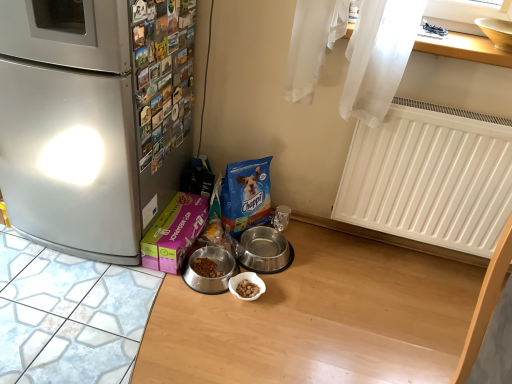
In order to face white plastic radiator at right, should I rotate leftwards or rightwards?

To face it directly, rotate right by 23.452 degrees.

Find the location of `wooden at upper right`. wooden at upper right is located at coordinates (465, 49).

The width and height of the screenshot is (512, 384). Identify the location of metallic stainless steel bowl at center, arranged as the third appliance when viewed from the right. (216, 269).

The image size is (512, 384). I want to click on white plastic radiator at right, so click(x=430, y=177).

Is silver metallic bowl at lower center, which is counted as the second appliance, starting from the bottom, far from pink matte box at lower left?

That's not correct — silver metallic bowl at lower center, which is counted as the second appliance, starting from the bottom, is a little close to pink matte box at lower left.

Is silver metallic bowl at lower center, which is counted as the second appliance, starting from the bottom, further to the viewer compared to pink matte box at lower left?

Yes, the depth of silver metallic bowl at lower center, which is counted as the second appliance, starting from the bottom, is greater than that of pink matte box at lower left.

Is silver metallic bowl at lower center, which is the second appliance in right-to-left order, looking in the opposite direction of pink matte box at lower left?

Absolutely, silver metallic bowl at lower center, which is the second appliance in right-to-left order, is directed away from pink matte box at lower left.

In the scene shown: Is pink matte box at lower left positioned with its back to brushed metal refrigerator at left?

Correct, pink matte box at lower left is looking away from brushed metal refrigerator at left.

From a real-world perspective, is pink matte box at lower left on brushed metal refrigerator at left?

Incorrect, from a real-world perspective, pink matte box at lower left is lower than brushed metal refrigerator at left.

Considering the relative sizes of pink matte box at lower left and brushed metal refrigerator at left in the image provided, is pink matte box at lower left bigger than brushed metal refrigerator at left?

No.

Between pink matte box at lower left and brushed metal refrigerator at left, which one has less height?

pink matte box at lower left.

From the image's perspective, is yellow ceramic bowl at upper right, the first appliance in the top-to-bottom sequence, below metallic stainless steel bowl at center, which appears as the first appliance when ordered from the bottom?

Answer: No.

Does yellow ceramic bowl at upper right, which ranks as the 1th appliance in right-to-left order, have a lesser height compared to metallic stainless steel bowl at center, which is the 1th appliance in left-to-right order?

In fact, yellow ceramic bowl at upper right, which ranks as the 1th appliance in right-to-left order, may be taller than metallic stainless steel bowl at center, which is the 1th appliance in left-to-right order.

Is yellow ceramic bowl at upper right, acting as the 3th appliance starting from the bottom, not within metallic stainless steel bowl at center, which appears as the 3th appliance when viewed from the top?

Yes, yellow ceramic bowl at upper right, acting as the 3th appliance starting from the bottom, is located beyond the bounds of metallic stainless steel bowl at center, which appears as the 3th appliance when viewed from the top.

Which is closer, (x=490, y=20) or (x=187, y=283)?

The point (x=490, y=20) is closer to the camera.

Between white plastic radiator at right and metallic stainless steel bowl at center, which appears as the first appliance when ordered from the bottom, which one appears on the left side from the viewer's perspective?

From the viewer's perspective, metallic stainless steel bowl at center, which appears as the first appliance when ordered from the bottom, appears more on the left side.

Between white plastic radiator at right and metallic stainless steel bowl at center, which appears as the first appliance when ordered from the bottom, which one has larger size?

white plastic radiator at right is bigger.

Is white plastic radiator at right not close to metallic stainless steel bowl at center, which is the 1th appliance in left-to-right order?

No, white plastic radiator at right is in close proximity to metallic stainless steel bowl at center, which is the 1th appliance in left-to-right order.

Can you confirm if white plastic radiator at right is shorter than metallic stainless steel bowl at center, which appears as the first appliance when ordered from the bottom?

No, white plastic radiator at right is not shorter than metallic stainless steel bowl at center, which appears as the first appliance when ordered from the bottom.

Can you tell me how much metallic stainless steel bowl at center, which appears as the first appliance when ordered from the bottom, and brushed metal refrigerator at left differ in facing direction?

7.9 degrees.

Does metallic stainless steel bowl at center, arranged as the third appliance when viewed from the right, have a lesser width compared to brushed metal refrigerator at left?

Indeed, metallic stainless steel bowl at center, arranged as the third appliance when viewed from the right, has a lesser width compared to brushed metal refrigerator at left.

Identify the location of refrigerator that appears in front of the metallic stainless steel bowl at center, which is the 1th appliance in left-to-right order. This screenshot has height=384, width=512. (94, 119).

Is point (219, 266) more distant than point (14, 110)?

Yes, point (219, 266) is farther from viewer.

Do you think wooden at upper right is within silver metallic bowl at lower center, which is counted as the second appliance, starting from the bottom, or outside of it?

The correct answer is: outside.

From the picture: Considering the positions of objects wooden at upper right and silver metallic bowl at lower center, which is counted as the second appliance, starting from the bottom, in the image provided, who is more to the left, wooden at upper right or silver metallic bowl at lower center, which is counted as the second appliance, starting from the bottom,?

From the viewer's perspective, silver metallic bowl at lower center, which is counted as the second appliance, starting from the bottom, appears more on the left side.

Who is taller, wooden at upper right or silver metallic bowl at lower center, which is the second appliance in right-to-left order?

With more height is silver metallic bowl at lower center, which is the second appliance in right-to-left order.

The image size is (512, 384). In order to click on appliance that is the 1st object directly below the wooden at upper right (from a real-world perspective) in this screenshot , I will do `click(264, 250)`.

Which object is closer to the camera, metallic stainless steel bowl at center, which is the 1th appliance in left-to-right order, or wooden at upper right?

Positioned in front is wooden at upper right.

Which of these two, metallic stainless steel bowl at center, arranged as the third appliance when viewed from the right, or wooden at upper right, is bigger?

Bigger between the two is metallic stainless steel bowl at center, arranged as the third appliance when viewed from the right.

Between metallic stainless steel bowl at center, arranged as the third appliance when viewed from the right, and wooden at upper right, which one appears on the left side from the viewer's perspective?

From the viewer's perspective, metallic stainless steel bowl at center, arranged as the third appliance when viewed from the right, appears more on the left side.

From a real-world perspective, is metallic stainless steel bowl at center, which appears as the first appliance when ordered from the bottom, physically located above or below wooden at upper right?

In terms of real-world spatial position, metallic stainless steel bowl at center, which appears as the first appliance when ordered from the bottom, is below wooden at upper right.

This screenshot has height=384, width=512. In order to click on box positioned vertically above the silver metallic bowl at lower center, which is counted as the second appliance, starting from the bottom (from a real-world perspective) in this screenshot , I will do `click(174, 233)`.

Find the location of a particular element. The image size is (512, 384). refrigerator to the left of pink matte box at lower left is located at coordinates (94, 119).

When comparing their distances from white plastic radiator at right, does brushed metal refrigerator at left or silver metallic bowl at lower center, which is counted as the second appliance, starting from the bottom, seem further?

brushed metal refrigerator at left is further to white plastic radiator at right.

Based on their spatial positions, is metallic stainless steel bowl at center, arranged as the third appliance when viewed from the right, or white plastic radiator at right closer to yellow ceramic bowl at upper right, acting as the 3th appliance starting from the bottom?

The object closer to yellow ceramic bowl at upper right, acting as the 3th appliance starting from the bottom, is white plastic radiator at right.

Consider the image. From the image, which object appears to be nearer to wooden at upper right, yellow ceramic bowl at upper right, acting as the 3th appliance starting from the bottom, or white plastic radiator at right?

yellow ceramic bowl at upper right, acting as the 3th appliance starting from the bottom, is positioned closer to the anchor wooden at upper right.

Based on their spatial positions, is white plastic radiator at right or metallic stainless steel bowl at center, which appears as the first appliance when ordered from the bottom, closer to pink matte box at lower left?

metallic stainless steel bowl at center, which appears as the first appliance when ordered from the bottom, lies closer to pink matte box at lower left than the other object.

Consider the image. Considering their positions, is pink matte box at lower left positioned further to white plastic radiator at right than brushed metal refrigerator at left?

The object further to white plastic radiator at right is brushed metal refrigerator at left.

Based on their spatial positions, is brushed metal refrigerator at left or white plastic radiator at right closer to pink matte box at lower left?

Among the two, brushed metal refrigerator at left is located nearer to pink matte box at lower left.

Considering their positions, is white plastic radiator at right positioned closer to wooden at upper right than metallic stainless steel bowl at center, arranged as the third appliance when viewed from the right?

Among the two, white plastic radiator at right is located nearer to wooden at upper right.

From the picture: Considering their positions, is yellow ceramic bowl at upper right, which ranks as the 1th appliance in right-to-left order, positioned closer to silver metallic bowl at lower center, which is counted as the second appliance, starting from the bottom, than brushed metal refrigerator at left?

brushed metal refrigerator at left is positioned closer to the anchor silver metallic bowl at lower center, which is counted as the second appliance, starting from the bottom.

Locate an element on the screen. window sill between silver metallic bowl at lower center, which is the second appliance in right-to-left order, and yellow ceramic bowl at upper right, which is the third appliance from left to right is located at coordinates pos(465,49).

At what (x,y) coordinates should I click in order to perform the action: click on radiator between brushed metal refrigerator at left and yellow ceramic bowl at upper right, acting as the 3th appliance starting from the bottom, from left to right. Please return your answer as a coordinate pair (x, y). This screenshot has height=384, width=512. Looking at the image, I should click on (430, 177).

The width and height of the screenshot is (512, 384). I want to click on window sill located between brushed metal refrigerator at left and yellow ceramic bowl at upper right, which ranks as the 1th appliance in right-to-left order, in the left-right direction, so click(465, 49).

At what (x,y) coordinates should I click in order to perform the action: click on radiator between metallic stainless steel bowl at center, arranged as the third appliance when viewed from the right, and yellow ceramic bowl at upper right, the first appliance in the top-to-bottom sequence, from left to right. Please return your answer as a coordinate pair (x, y). This screenshot has height=384, width=512. Looking at the image, I should click on (430, 177).